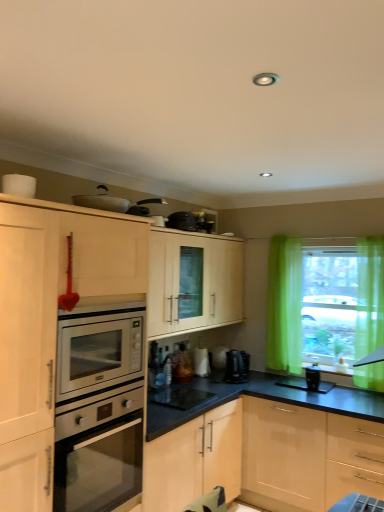
Image resolution: width=384 pixels, height=512 pixels. What do you see at coordinates (179, 396) in the screenshot?
I see `black glossy coffee maker at center, the third appliance positioned from the top` at bounding box center [179, 396].

What do you see at coordinates (323, 303) in the screenshot? This screenshot has width=384, height=512. I see `green sheer curtains at right` at bounding box center [323, 303].

Locate an element on the screen. The width and height of the screenshot is (384, 512). metallic silver pan at upper center, positioned as the 3th appliance in back-to-front order is located at coordinates (115, 202).

Describe the element at coordinates (335, 370) in the screenshot. I see `translucent glass window sill at lower right` at that location.

Describe the element at coordinates (312, 377) in the screenshot. I see `black plastic canister at lower right, the third appliance when ordered from front to back` at that location.

You are a GUI agent. You are given a task and a screenshot of the screen. Output one action in this format:
    pyautogui.click(x=<x>, y=<y>)
    Task: Click on the black glossy coffee maker at center, which appears as the 2th appliance when viewed from the left
    The image size is (384, 512).
    Given the screenshot: What is the action you would take?
    pyautogui.click(x=179, y=396)

From a real-world perspective, which object rests below the other?

black plastic canister at lower right, marked as the first appliance in a back-to-front arrangement, is physically lower.

What are the coordinates of `window above the black plastic canister at lower right, the third appliance when ordered from front to back (from a real-world perspective)` in the screenshot? It's located at (323, 303).

Is black plastic canister at lower right, acting as the 2th appliance starting from the top, inside green sheer curtains at right?

Definitely not — black plastic canister at lower right, acting as the 2th appliance starting from the top, is not inside green sheer curtains at right.

Is green sheer curtain at right taller or shorter than silver metallic oven at left?

Clearly, green sheer curtain at right is taller compared to silver metallic oven at left.

Is green sheer curtain at right bigger than silver metallic oven at left?

Actually, green sheer curtain at right might be smaller than silver metallic oven at left.

From the image's perspective, which object appears higher, green sheer curtain at right or silver metallic oven at left?

green sheer curtain at right.

Is green sheer curtain at right far from silver metallic oven at left?

Absolutely, green sheer curtain at right is distant from silver metallic oven at left.

Considering the relative sizes of black plastic coffee machine at center and black plastic canister at lower right, marked as the first appliance in a back-to-front arrangement, in the image provided, is black plastic coffee machine at center taller than black plastic canister at lower right, marked as the first appliance in a back-to-front arrangement,?

Yes, black plastic coffee machine at center is taller than black plastic canister at lower right, marked as the first appliance in a back-to-front arrangement.

Measure the distance from black plastic coffee machine at center to black plastic canister at lower right, marked as the first appliance in a back-to-front arrangement.

black plastic coffee machine at center is 69.03 centimeters from black plastic canister at lower right, marked as the first appliance in a back-to-front arrangement.

Is black plastic coffee machine at center smaller than black plastic canister at lower right, marked as the first appliance in a back-to-front arrangement?

No, black plastic coffee machine at center is not smaller than black plastic canister at lower right, marked as the first appliance in a back-to-front arrangement.

What's the angular difference between green sheer curtain at right and black plastic coffee machine at center's facing directions?

There is a 93-degree angle between the facing directions of green sheer curtain at right and black plastic coffee machine at center.

From a real-world perspective, is green sheer curtain at right physically located above or below black plastic coffee machine at center?

From a real-world perspective, green sheer curtain at right is physically above black plastic coffee machine at center.

Is green sheer curtain at right far from black plastic coffee machine at center?

Absolutely, green sheer curtain at right is distant from black plastic coffee machine at center.

Based on the photo, is green sheer curtain at right oriented towards black plastic coffee machine at center?

No, green sheer curtain at right is not oriented towards black plastic coffee machine at center.

Is there a large distance between metallic silver pan at upper center, positioned as the 3th appliance in back-to-front order, and black glossy coffee maker at center, the second appliance positioned from the front?

That's right, there is a large distance between metallic silver pan at upper center, positioned as the 3th appliance in back-to-front order, and black glossy coffee maker at center, the second appliance positioned from the front.

Between metallic silver pan at upper center, placed as the third appliance when sorted from right to left, and black glossy coffee maker at center, which is the first appliance from bottom to top, which one is positioned behind?

black glossy coffee maker at center, which is the first appliance from bottom to top, is behind.

Measure the distance from metallic silver pan at upper center, positioned as the 3th appliance in back-to-front order, to black glossy coffee maker at center, the second appliance positioned from the front.

metallic silver pan at upper center, positioned as the 3th appliance in back-to-front order, is 1.35 meters from black glossy coffee maker at center, the second appliance positioned from the front.

Is black plastic canister at lower right, marked as the first appliance in a back-to-front arrangement, oriented towards black glossy coffee maker at center, positioned as the second appliance in back-to-front order?

No, black plastic canister at lower right, marked as the first appliance in a back-to-front arrangement, does not turn towards black glossy coffee maker at center, positioned as the second appliance in back-to-front order.

Is black plastic canister at lower right, the third appliance when ordered from front to back, inside or outside of black glossy coffee maker at center, which is the first appliance from bottom to top?

black plastic canister at lower right, the third appliance when ordered from front to back, is not enclosed by black glossy coffee maker at center, which is the first appliance from bottom to top.

Considering the relative sizes of black plastic canister at lower right, the third appliance when ordered from front to back, and black glossy coffee maker at center, arranged as the 2th appliance when viewed from the right, in the image provided, is black plastic canister at lower right, the third appliance when ordered from front to back, bigger than black glossy coffee maker at center, arranged as the 2th appliance when viewed from the right,?

Actually, black plastic canister at lower right, the third appliance when ordered from front to back, might be smaller than black glossy coffee maker at center, arranged as the 2th appliance when viewed from the right.

Between black plastic canister at lower right, placed as the 3th appliance when sorted from left to right, and black glossy coffee maker at center, which is the first appliance from bottom to top, which one has less height?

With less height is black glossy coffee maker at center, which is the first appliance from bottom to top.

Can you see translucent glass window sill at lower right touching black plastic canister at lower right, placed as the 3th appliance when sorted from left to right?

No.

Could you tell me if translucent glass window sill at lower right is turned towards black plastic canister at lower right, the third appliance when ordered from front to back?

Yes, translucent glass window sill at lower right is oriented towards black plastic canister at lower right, the third appliance when ordered from front to back.

Considering the relative positions of translucent glass window sill at lower right and black plastic canister at lower right, placed as the 3th appliance when sorted from left to right, in the image provided, is translucent glass window sill at lower right to the left of black plastic canister at lower right, placed as the 3th appliance when sorted from left to right, from the viewer's perspective?

In fact, translucent glass window sill at lower right is to the right of black plastic canister at lower right, placed as the 3th appliance when sorted from left to right.

Is translucent glass window sill at lower right bigger or smaller than black plastic canister at lower right, acting as the 2th appliance starting from the top?

In the image, translucent glass window sill at lower right appears to be larger than black plastic canister at lower right, acting as the 2th appliance starting from the top.

Locate an element on the screen. window on the right of the black plastic canister at lower right, which appears as the 1th appliance when viewed from the right is located at coordinates (323, 303).

Locate an element on the screen. oven located below the green sheer curtain at right (from the image's perspective) is located at coordinates (100, 455).

Which object lies further to the anchor point black plastic canister at lower right, acting as the 2th appliance starting from the top, green sheer curtain at right or green sheer curtains at right?

green sheer curtains at right is positioned further to the anchor black plastic canister at lower right, acting as the 2th appliance starting from the top.

Which object lies nearer to the anchor point green sheer curtain at right, black glossy coffee maker at center, the second appliance positioned from the front, or black plastic coffee machine at center?

Among the two, black plastic coffee machine at center is located nearer to green sheer curtain at right.

From the image, which object appears to be farther from green sheer curtains at right, green sheer curtain at right or translucent glass window sill at lower right?

translucent glass window sill at lower right.

Based on their spatial positions, is metallic silver pan at upper center, placed as the third appliance when sorted from right to left, or translucent glass window sill at lower right closer to black glossy coffee maker at center, the second appliance positioned from the front?

translucent glass window sill at lower right.

From the image, which object appears to be nearer to metallic silver pan at upper center, the first appliance from the front, green sheer curtains at right or black plastic canister at lower right, which appears as the 1th appliance when viewed from the right?

Based on the image, green sheer curtains at right appears to be nearer to metallic silver pan at upper center, the first appliance from the front.

Estimate the real-world distances between objects in this image. Which object is closer to metallic silver pan at upper center, the 1th appliance from the top, translucent glass window sill at lower right or green sheer curtain at right?

green sheer curtain at right is closer to metallic silver pan at upper center, the 1th appliance from the top.

When comparing their distances from black plastic coffee machine at center, does translucent glass window sill at lower right or green sheer curtains at right seem closer?

Based on the image, translucent glass window sill at lower right appears to be nearer to black plastic coffee machine at center.

Looking at the image, which one is located closer to metallic silver pan at upper center, the first appliance from the front, green sheer curtains at right or translucent glass window sill at lower right?

The object closer to metallic silver pan at upper center, the first appliance from the front, is green sheer curtains at right.

This screenshot has width=384, height=512. I want to click on coffee machine between silver metallic oven at left and green sheer curtains at right from left to right, so click(x=237, y=366).

Identify the location of window sill between silver metallic oven at left and green sheer curtain at right. click(x=335, y=370).

Where is `curtain between green sheer curtains at right and black plastic canister at lower right, marked as the first appliance in a back-to-front arrangement, in the vertical direction`? curtain between green sheer curtains at right and black plastic canister at lower right, marked as the first appliance in a back-to-front arrangement, in the vertical direction is located at coordinates (369, 296).

Locate an element on the screen. The width and height of the screenshot is (384, 512). coffee machine between black glossy coffee maker at center, positioned as the second appliance in back-to-front order, and green sheer curtains at right, in the horizontal direction is located at coordinates (237, 366).